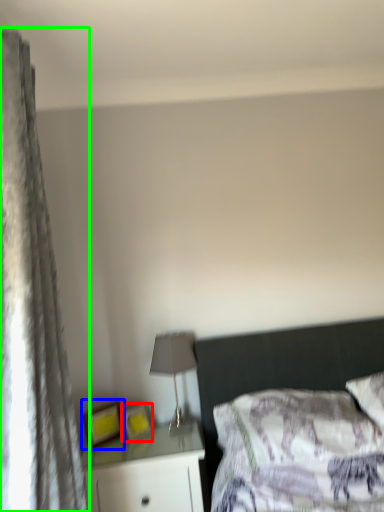
Question: Based on their relative distances, which object is nearer to picture frame (highlighted by a red box)? Choose from picture frame (highlighted by a blue box) and curtain (highlighted by a green box).

Choices:
 (A) picture frame
 (B) curtain

Answer: (A)